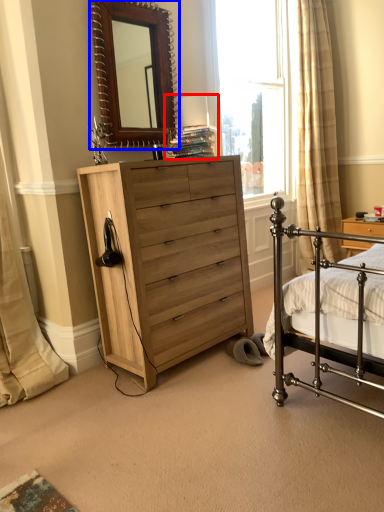
Question: Which point is closer to the camera, table lamp (highlighted by a red box) or mirror (highlighted by a blue box)?

Choices:
 (A) table lamp
 (B) mirror

Answer: (B)